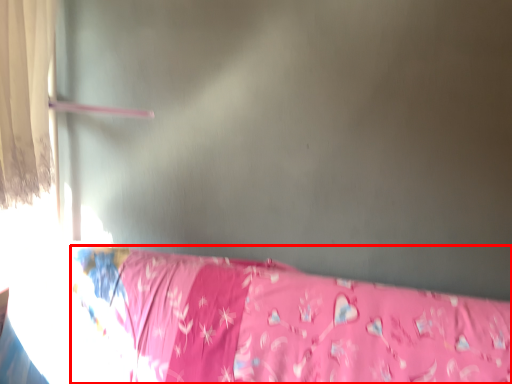
Question: Where is furniture (annotated by the red box) located in relation to curtain in the image?

Choices:
 (A) left
 (B) right

Answer: (B)